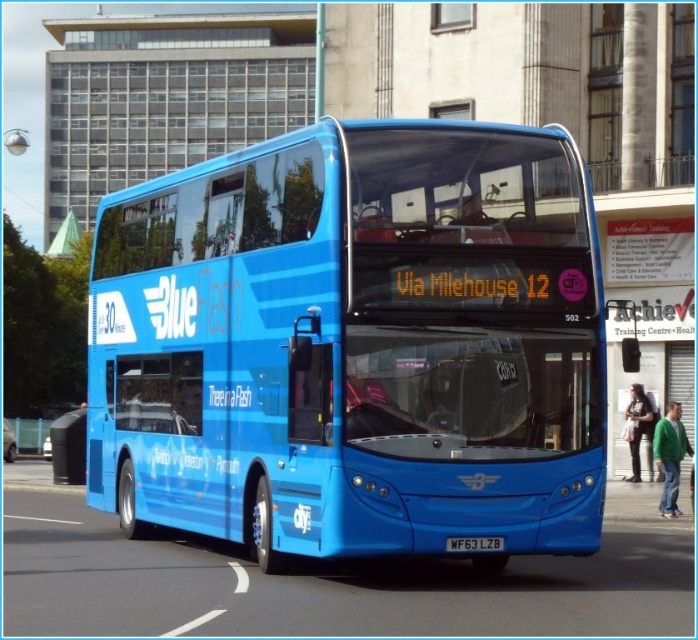
Question: Is blue glossy bus at center above white plastic license plate at center?

Choices:
 (A) yes
 (B) no

Answer: (A)

Question: Which of the following is the farthest from the observer?

Choices:
 (A) white plastic license plate at center
 (B) matte black trash can at lower left

Answer: (B)

Question: Considering the real-world distances, which object is farthest from the white plastic license plate at center?

Choices:
 (A) matte black trash can at lower left
 (B) blue glossy bus at center

Answer: (A)

Question: Does blue glossy bus at center appear under matte black trash can at lower left?

Choices:
 (A) no
 (B) yes

Answer: (A)

Question: Which object is farther from the camera taking this photo?

Choices:
 (A) blue glossy bus at center
 (B) matte black trash can at lower left

Answer: (B)

Question: Is matte black trash can at lower left in front of white plastic license plate at center?

Choices:
 (A) no
 (B) yes

Answer: (A)